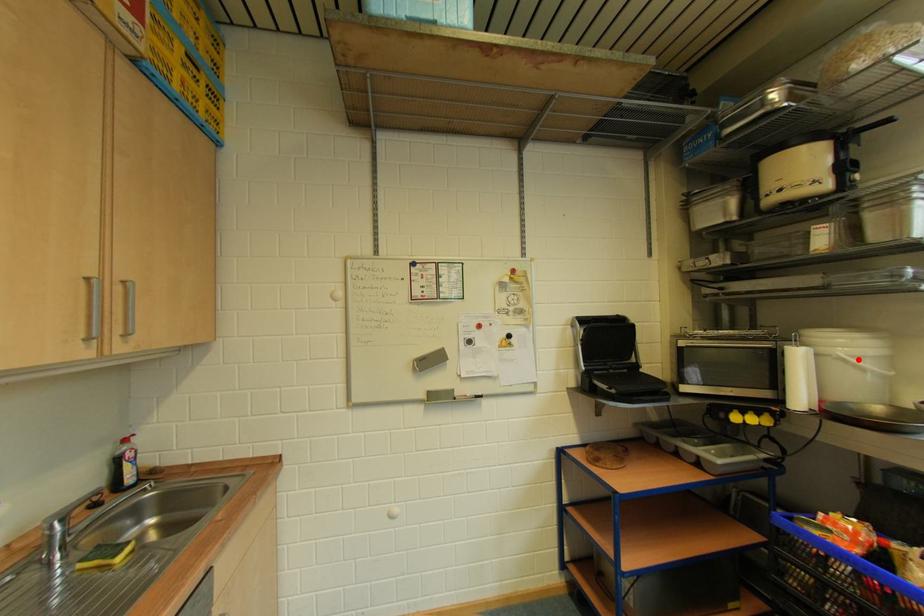
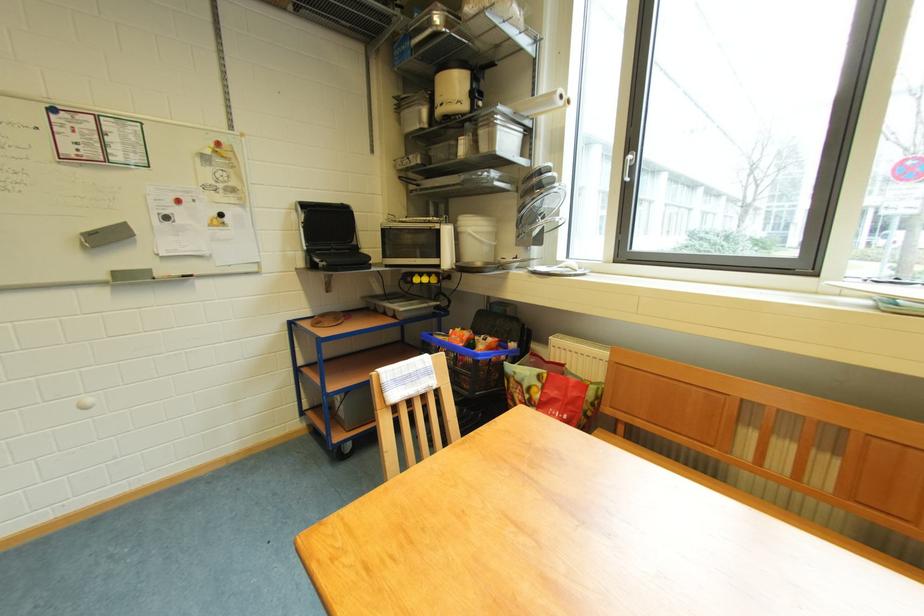
In the second image, find the point that corresponds to the highlighted location in the first image.

(481, 235)